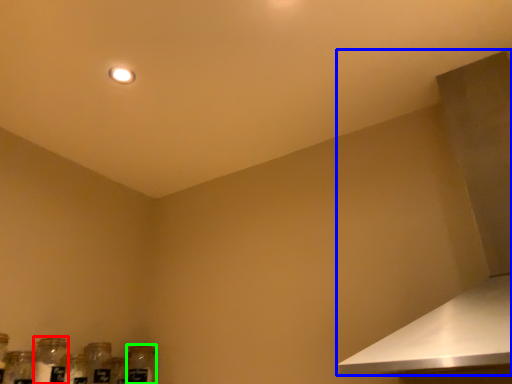
Question: Which object is positioned farthest from bottle (highlighted by a red box)? Select from vent (highlighted by a blue box) and glass bottle (highlighted by a green box).

Choices:
 (A) vent
 (B) glass bottle

Answer: (A)